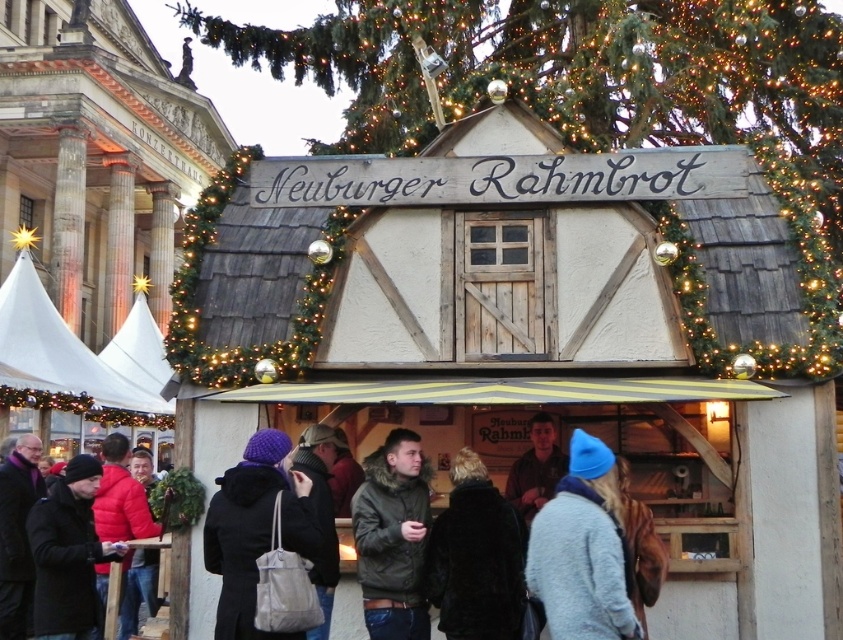
You are a customer at the market and want to approach the stall. You see the dark green textured jacket at center and the white fabric canopy at lower left. Which object should you walk towards first to reach the stall?

You should walk towards the white fabric canopy at lower left first because the dark green textured jacket at center is to the right of it, meaning the canopy is closer to the stall entrance.

Consider the image. You are a customer at the market and want to find shade from the sun. The white fabric canopy at lower left and the brown leather jacket at center are both in your line of sight. Which object provides more horizontal coverage to block the sun?

The white fabric canopy at lower left might be wider than brown leather jacket at center, so it likely offers more horizontal coverage to block the sun.

You are standing at the market and want to place a decoration between the two points, point (12,307) and point (525,493). Which point should the decoration be closer to if it needs to be in front of both?

The decoration should be closer to point (525,493) because point (12,307) is behind point (525,493), so placing it near the front point ensures it is in front of both.